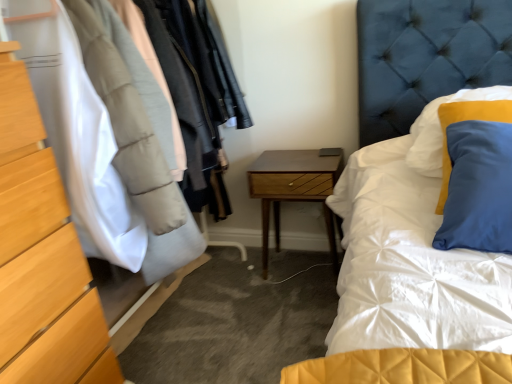
Question: From a real-world perspective, is wooden dresser at left physically located above or below woodenmaterial/texturenightstand at center?

Choices:
 (A) above
 (B) below

Answer: (A)

Question: From the image's perspective, is wooden dresser at left above or below woodenmaterial/texturenightstand at center?

Choices:
 (A) above
 (B) below

Answer: (A)

Question: Considering the real-world distances, which object is farthest from the matte wood chest of drawers at left?

Choices:
 (A) woodenmaterial/texturenightstand at center
 (B) wooden dresser at left

Answer: (A)

Question: Based on their relative distances, which object is nearer to the wooden dresser at left?

Choices:
 (A) matte wood chest of drawers at left
 (B) woodenmaterial/texturenightstand at center

Answer: (A)